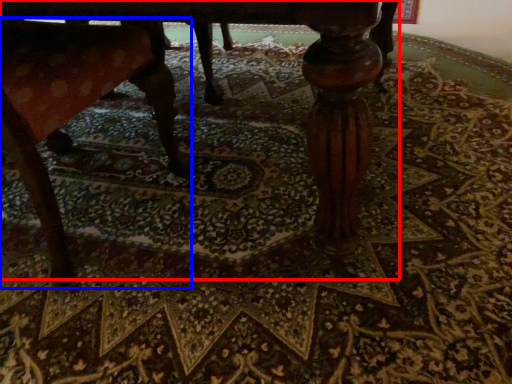
Question: Among these objects, which one is nearest to the camera, table (highlighted by a red box) or rocking chair (highlighted by a blue box)?

Choices:
 (A) table
 (B) rocking chair

Answer: (A)